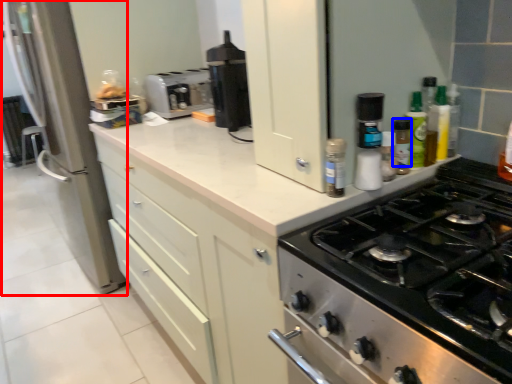
Question: Which of the following is the closest to the observer, glass door (highlighted by a red box) or bottle (highlighted by a blue box)?

Choices:
 (A) glass door
 (B) bottle

Answer: (B)